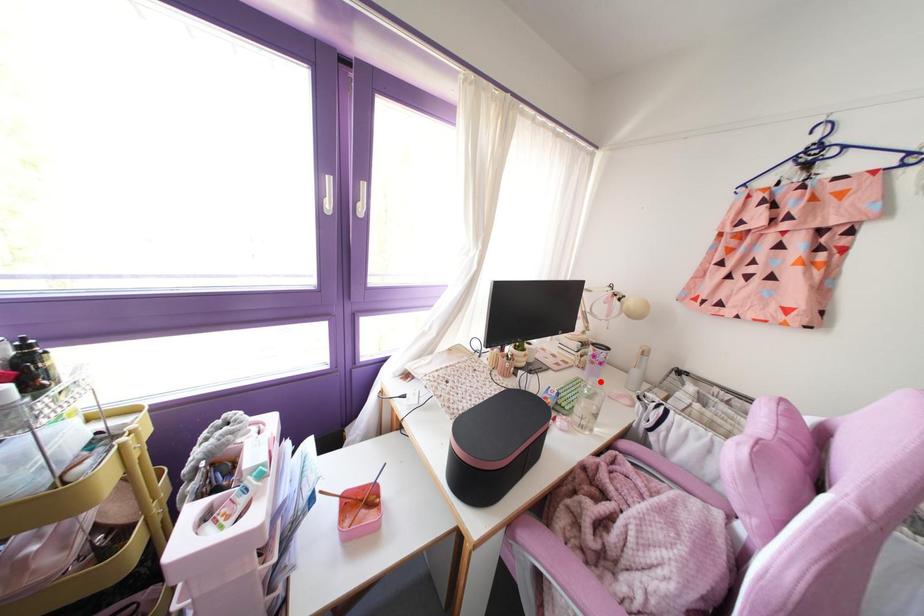
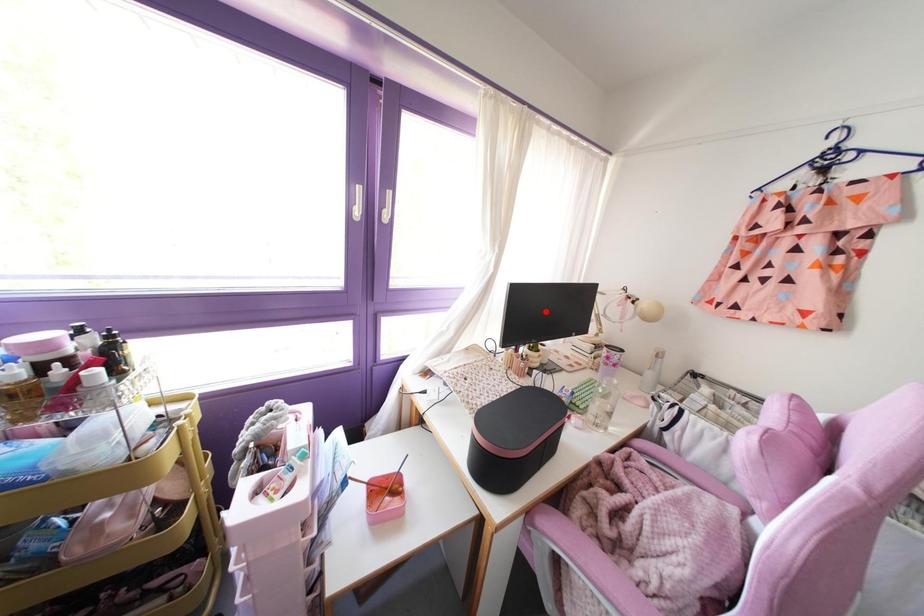
I am providing you with two images of the same scene from different viewpoints. A red point is marked on the first image and another point is marked on the second image. Does the point marked in image1 correspond to the same location as the one in image2?

No